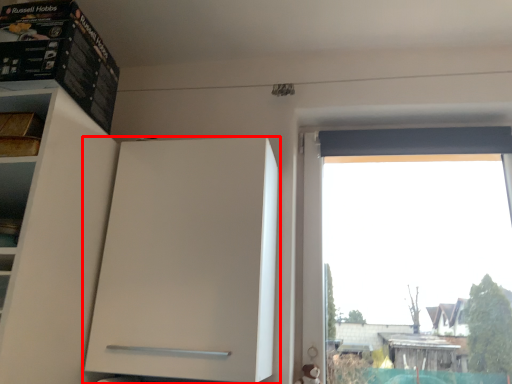
Question: From the image's perspective, where is cabinetry (annotated by the red box) located relative to cabinet?

Choices:
 (A) below
 (B) above

Answer: (A)